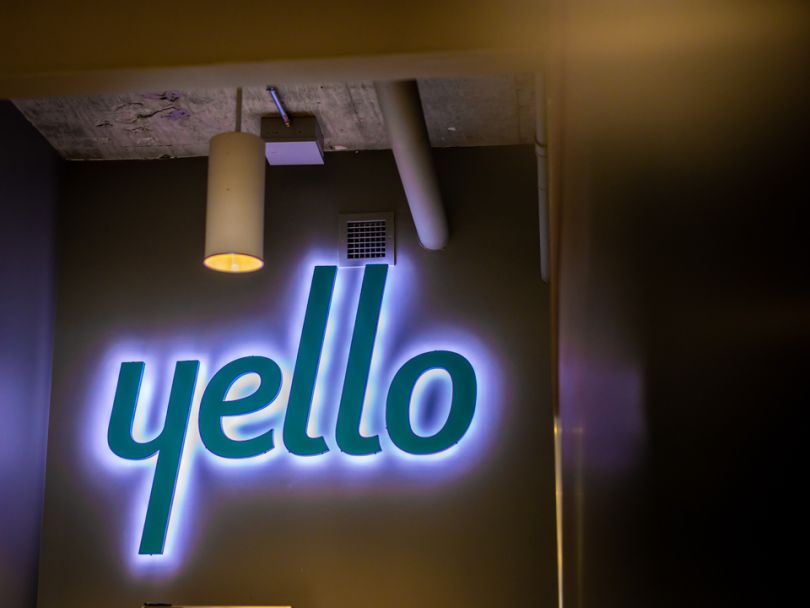
You are a GUI agent. You are given a task and a screenshot of the screen. Output one action in this format:
    pyautogui.click(x=<x>, y=<y>)
    Task: Click on the glowing wall sign
    The height and width of the screenshot is (608, 810).
    Given the screenshot: What is the action you would take?
    pyautogui.click(x=172, y=423)